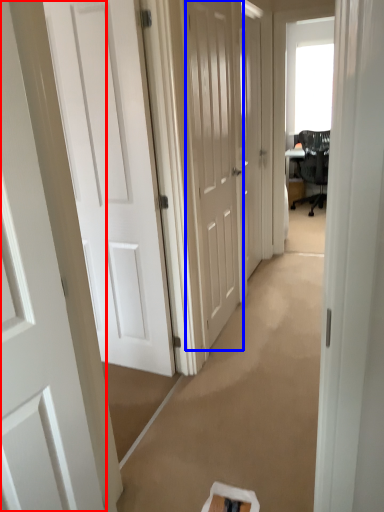
Question: Which point is further to the camera, door (highlighted by a red box) or door (highlighted by a blue box)?

Choices:
 (A) door
 (B) door

Answer: (B)